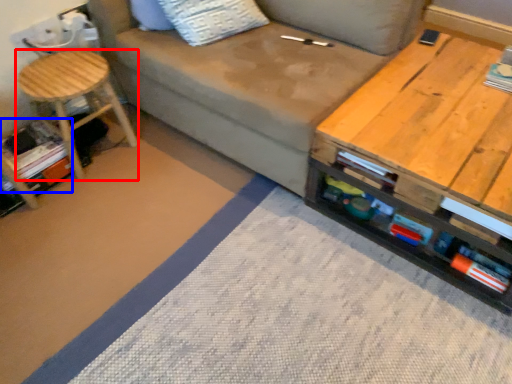
Question: Which object is closer to the camera taking this photo, stool (highlighted by a red box) or book (highlighted by a blue box)?

Choices:
 (A) stool
 (B) book

Answer: (A)